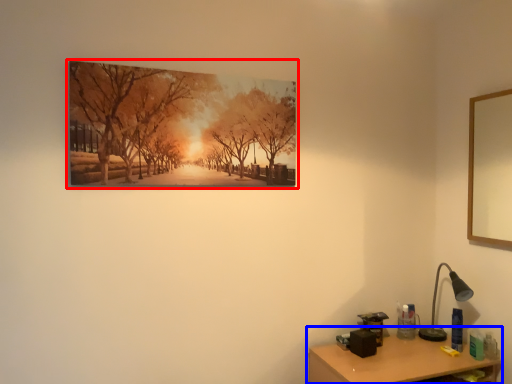
Question: Which point is closer to the camera, picture frame (highlighted by a red box) or table (highlighted by a blue box)?

Choices:
 (A) picture frame
 (B) table

Answer: (A)